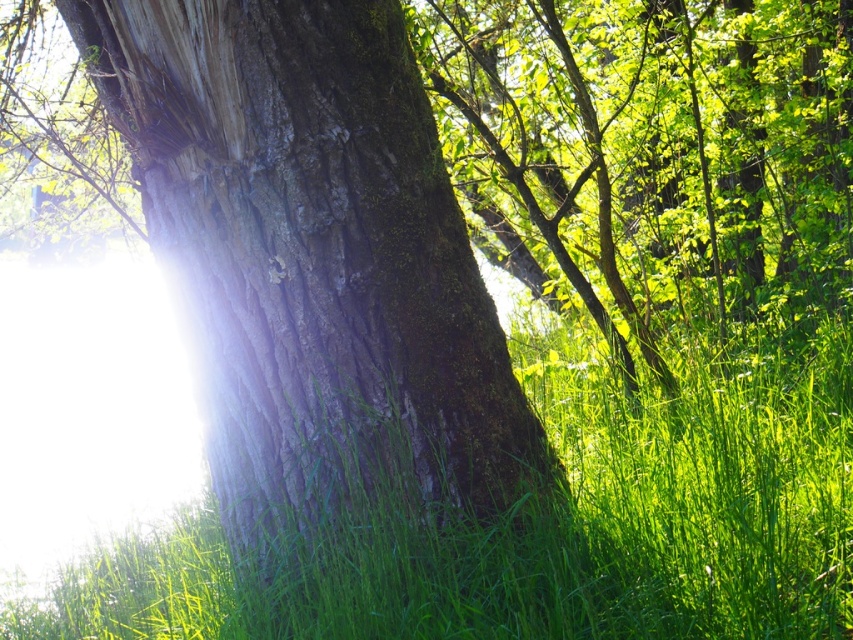
You are standing in front of the tree trunk and want to touch the point at coordinates [312,259]. Based on the scene description, what part of the tree will you be touching?

The point at coordinates [312,259] is located on the smooth bark tree trunk at center, so touching it would mean you are touching the tree trunk.